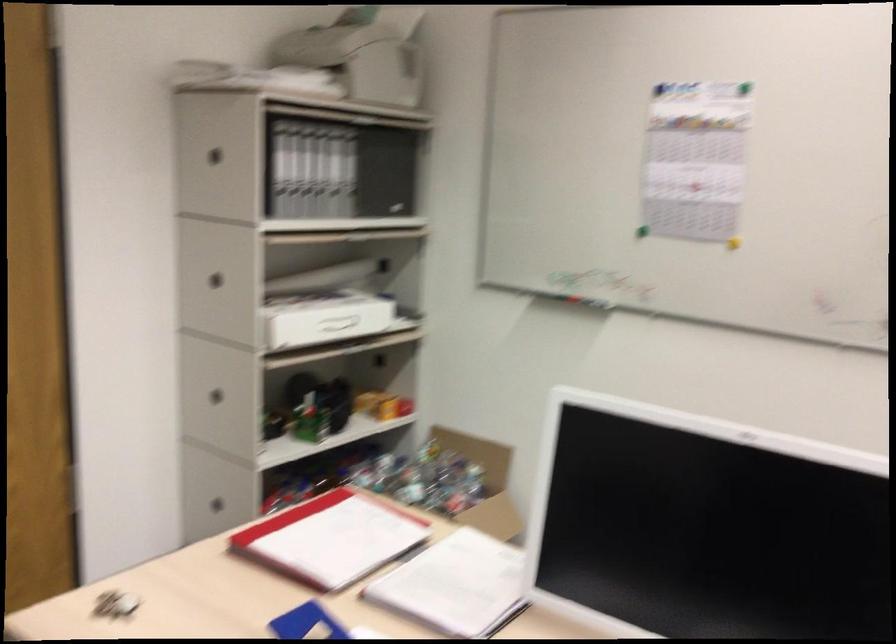
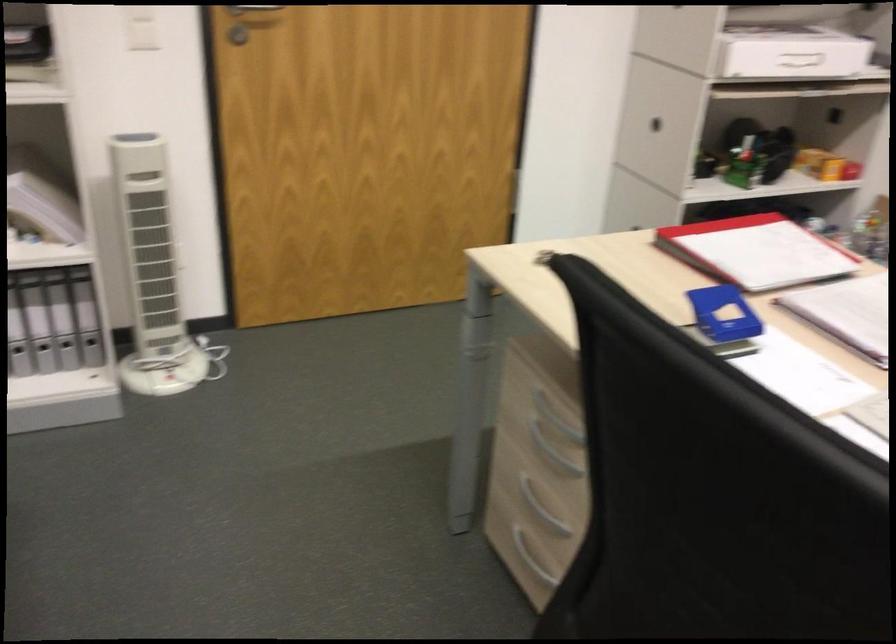
Where in the second image is the point corresponding to (213,397) from the first image?

(655, 124)